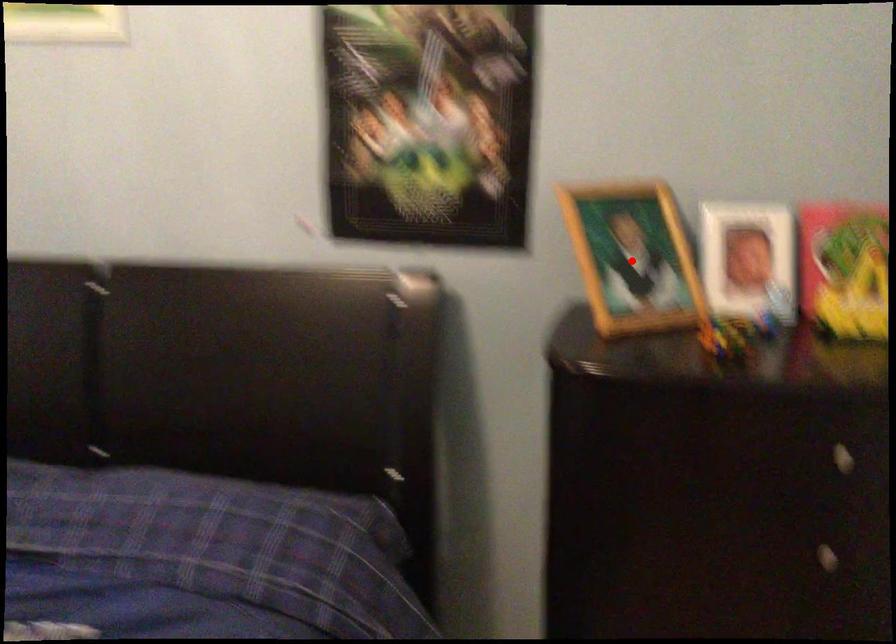
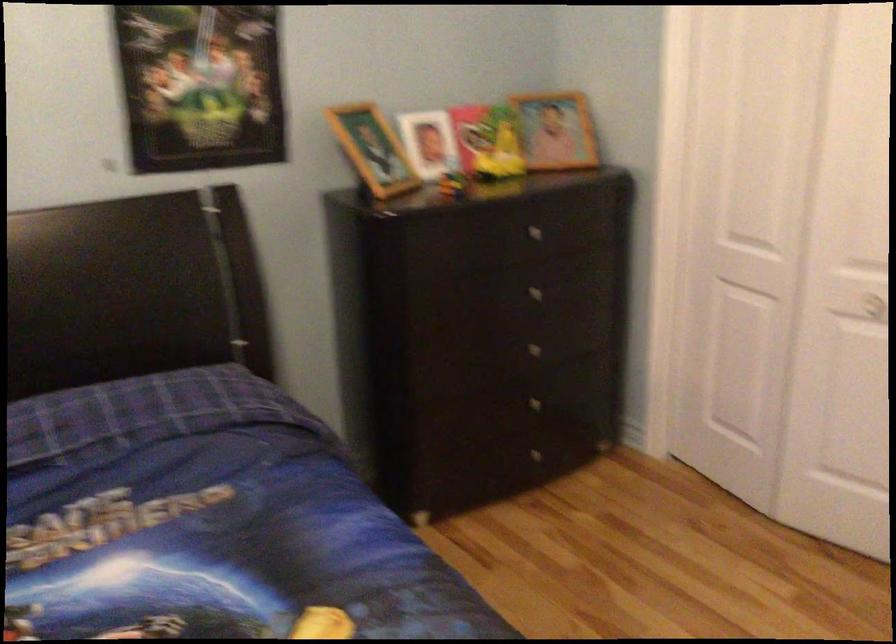
Find the pixel in the second image that matches the highlighted location in the first image.

(373, 149)